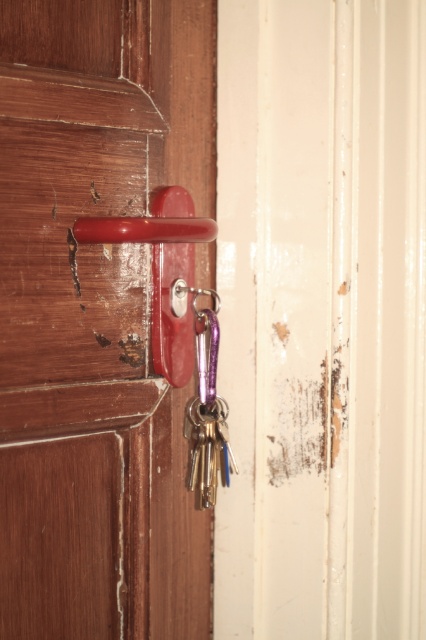
Question: Is rubberized red door handle at center to the right of purple metallic key at center from the viewer's perspective?

Choices:
 (A) no
 (B) yes

Answer: (A)

Question: Which object is farther from the camera taking this photo?

Choices:
 (A) matte plastic handle at center
 (B) rubberized red door handle at center
 (C) purple metallic key at center

Answer: (C)

Question: Is matte plastic handle at center below purple metallic key at center?

Choices:
 (A) no
 (B) yes

Answer: (A)

Question: Which object is the farthest from the purple metallic key at center?

Choices:
 (A) matte plastic handle at center
 (B) rubberized red door handle at center

Answer: (A)

Question: Which object appears closest to the camera in this image?

Choices:
 (A) matte plastic handle at center
 (B) purple metallic key at center

Answer: (A)

Question: Is the position of rubberized red door handle at center less distant than that of purple metallic key at center?

Choices:
 (A) no
 (B) yes

Answer: (B)